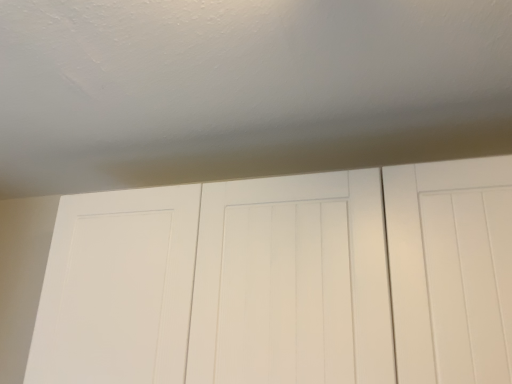
The image size is (512, 384). Describe the element at coordinates (284, 280) in the screenshot. I see `white matte door at center` at that location.

Where is `white matte door at center`? This screenshot has height=384, width=512. white matte door at center is located at coordinates (284, 280).

Image resolution: width=512 pixels, height=384 pixels. In order to click on white matte door at center in this screenshot , I will do `click(284, 280)`.